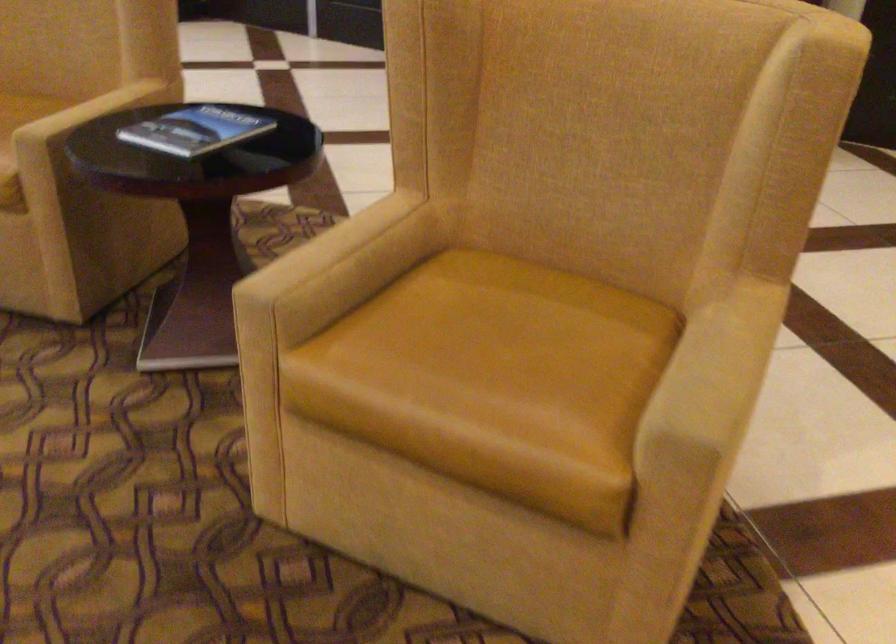
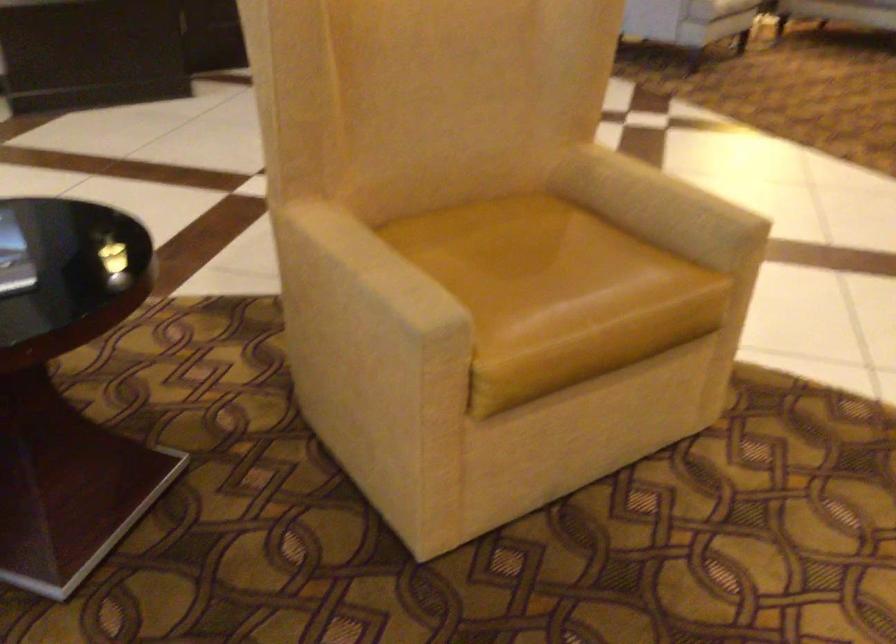
Where in the second image is the point corresponding to point 510,327 from the first image?

(520, 256)